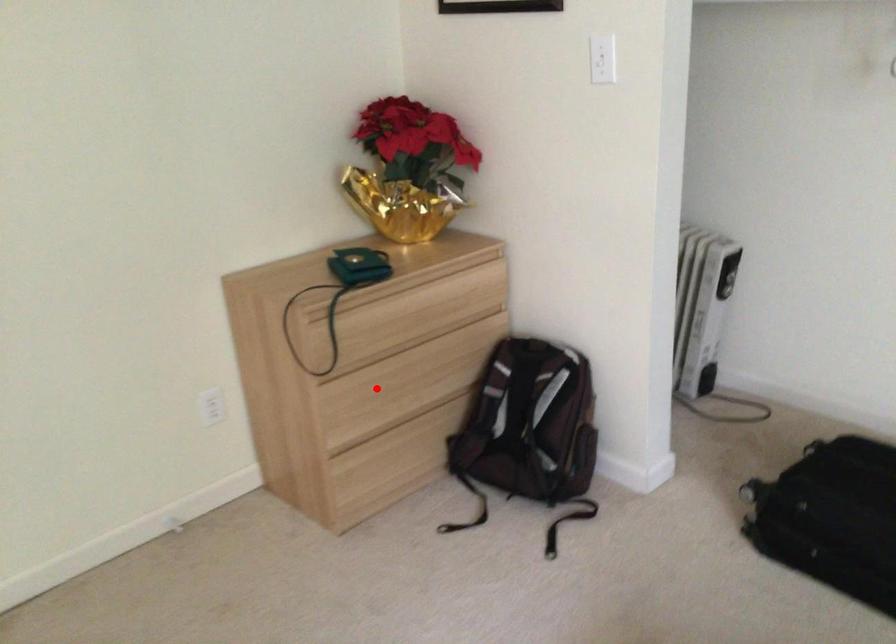
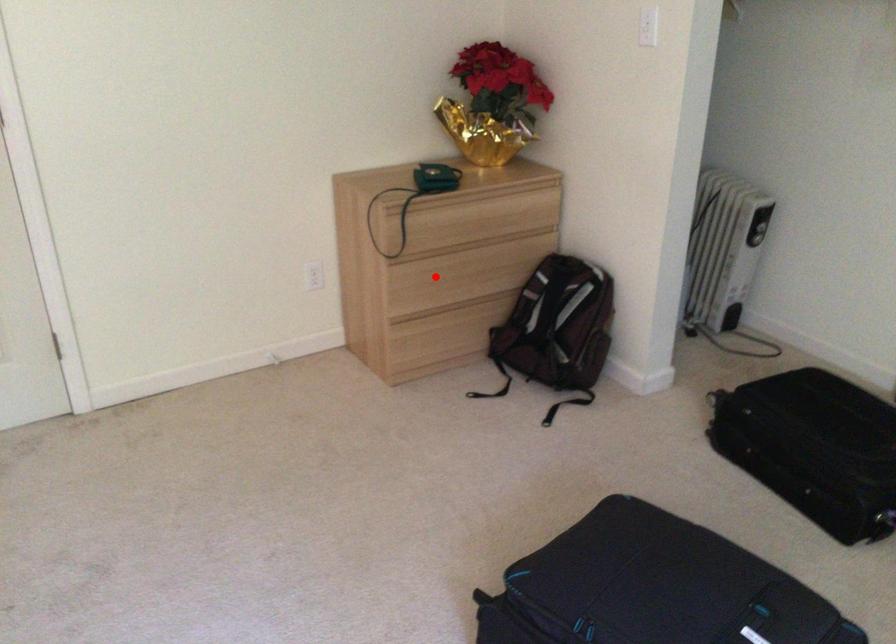
I am providing you with two images of the same scene from different viewpoints. A red point is marked on the first image and another point is marked on the second image. Are the points marked in image1 and image2 representing the same 3D position?

Yes